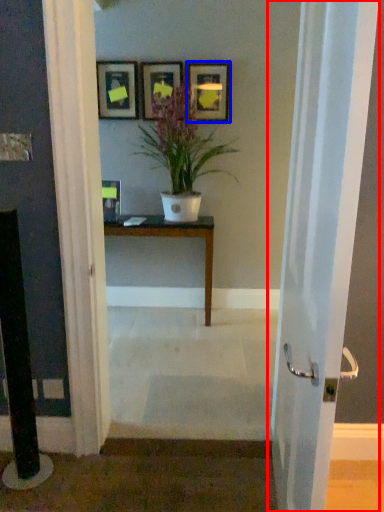
Question: Which of the following is the closest to the observer, door (highlighted by a red box) or picture frame (highlighted by a blue box)?

Choices:
 (A) door
 (B) picture frame

Answer: (A)